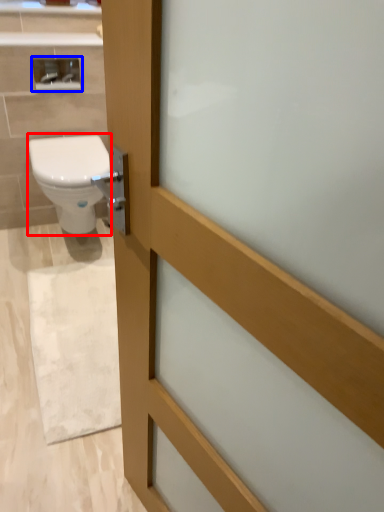
Question: Among these objects, which one is nearest to the camera, bidet (highlighted by a red box) or medicine cabinet (highlighted by a blue box)?

Choices:
 (A) bidet
 (B) medicine cabinet

Answer: (A)